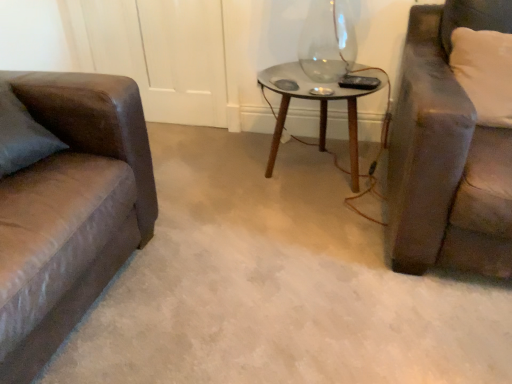
Question: Is clear glass table at center not within white fabric pillow at right?

Choices:
 (A) yes
 (B) no

Answer: (A)

Question: Is clear glass table at center positioned with its back to white fabric pillow at right?

Choices:
 (A) yes
 (B) no

Answer: (B)

Question: Considering the relative sizes of clear glass table at center and white fabric pillow at right in the image provided, is clear glass table at center thinner than white fabric pillow at right?

Choices:
 (A) no
 (B) yes

Answer: (A)

Question: Is clear glass table at center positioned far away from white fabric pillow at right?

Choices:
 (A) no
 (B) yes

Answer: (A)

Question: Considering the relative sizes of clear glass table at center and white fabric pillow at right in the image provided, is clear glass table at center smaller than white fabric pillow at right?

Choices:
 (A) no
 (B) yes

Answer: (A)

Question: From a real-world perspective, is clear glass table at center on white fabric pillow at right?

Choices:
 (A) no
 (B) yes

Answer: (A)

Question: Is the position of white fabric pillow at right more distant than that of clear glass table at center?

Choices:
 (A) no
 (B) yes

Answer: (A)

Question: From a real-world perspective, does white fabric pillow at right stand above clear glass table at center?

Choices:
 (A) no
 (B) yes

Answer: (B)

Question: From the image's perspective, does white fabric pillow at right appear lower than clear glass table at center?

Choices:
 (A) yes
 (B) no

Answer: (B)

Question: Is white fabric pillow at right taller than clear glass table at center?

Choices:
 (A) no
 (B) yes

Answer: (A)

Question: Does white fabric pillow at right have a lesser width compared to clear glass table at center?

Choices:
 (A) no
 (B) yes

Answer: (B)

Question: Considering the relative sizes of white fabric pillow at right and clear glass table at center in the image provided, is white fabric pillow at right wider than clear glass table at center?

Choices:
 (A) no
 (B) yes

Answer: (A)

Question: Is clear glass table at center wider or thinner than white fabric pillow at right?

Choices:
 (A) thin
 (B) wide

Answer: (B)